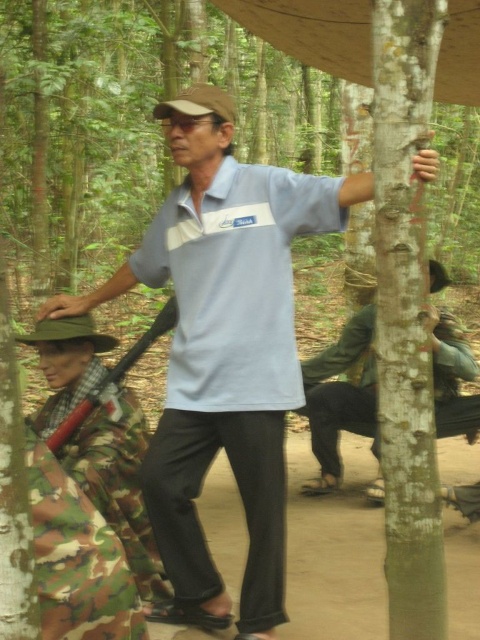
Question: In this image, where is smooth bark tree at right located relative to light blue fabric polo shirt at center?

Choices:
 (A) below
 (B) above

Answer: (A)

Question: Which of the following is the closest to the observer?

Choices:
 (A) (370, 484)
 (B) (320, 225)
 (C) (143, 250)
 (D) (419, 108)

Answer: (D)

Question: Which of the following is the farthest from the observer?

Choices:
 (A) light blue fabric polo shirt at center
 (B) smooth bark tree at right
 (C) green matte uniform at center
 (D) light blue cotton shirt at center

Answer: (C)

Question: Which of the following is the farthest from the observer?

Choices:
 (A) smooth bark tree at right
 (B) light blue fabric polo shirt at center
 (C) light blue cotton shirt at center

Answer: (B)

Question: Considering the relative positions of light blue cotton shirt at center and smooth bark tree at right in the image provided, where is light blue cotton shirt at center located with respect to smooth bark tree at right?

Choices:
 (A) above
 (B) below

Answer: (B)

Question: Does smooth bark tree at right appear on the left side of light blue fabric polo shirt at center?

Choices:
 (A) no
 (B) yes

Answer: (A)